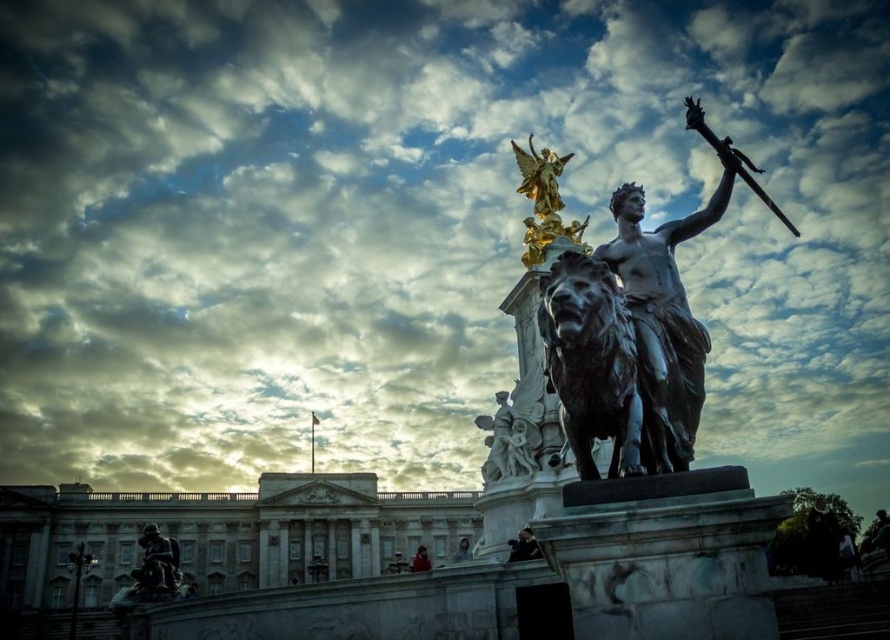
Does bronze statue at center appear over bronze statue at lower left?

Indeed, bronze statue at center is positioned over bronze statue at lower left.

Is point (565, 365) in front of point (146, 547)?

Yes, it is in front of point (146, 547).

The height and width of the screenshot is (640, 890). I want to click on bronze statue at center, so click(x=609, y=349).

Does gold polished statue at upper center have a greater width compared to bronze statue at lower left?

In fact, gold polished statue at upper center might be narrower than bronze statue at lower left.

Is gold polished statue at upper center positioned before bronze statue at lower left?

No.

Is point (577, 228) less distant than point (191, 584)?

That is True.

The height and width of the screenshot is (640, 890). What are the coordinates of `gold polished statue at upper center` in the screenshot? It's located at (543, 202).

Does point (548, 195) lie behind point (556, 193)?

No.

Based on the photo, which is above, bronze statue at center or gold polished statue at upper center?

gold polished statue at upper center is above.

Who is more forward, (527, 342) or (535, 212)?

Point (527, 342)

I want to click on bronze statue at center, so click(x=609, y=349).